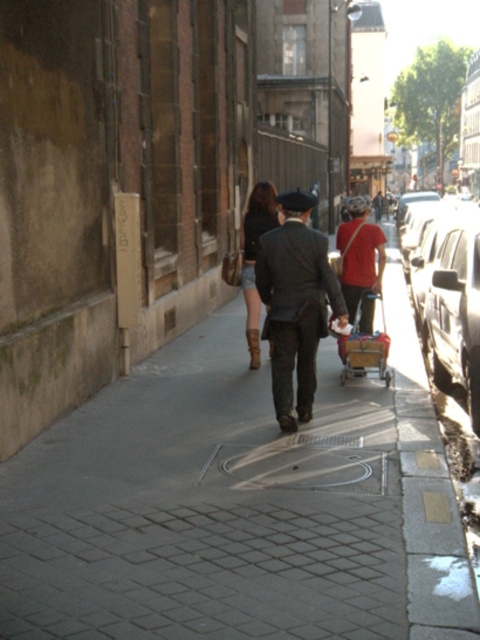
Question: Among these points, which one is nearest to the camera?

Choices:
 (A) (377, 266)
 (B) (474, 266)

Answer: (B)

Question: Estimate the real-world distances between objects in this image. Which object is farther from the shiny silver car at right?

Choices:
 (A) matte black coat at center
 (B) leather boots at center

Answer: (B)

Question: Observing the image, what is the correct spatial positioning of matte black coat at center in reference to shiny silver car at right?

Choices:
 (A) below
 (B) above

Answer: (A)

Question: Based on their relative distances, which object is farther from the matte red shirt at center?

Choices:
 (A) matte black coat at center
 (B) metallic silver shopping cart at center

Answer: (A)

Question: Can you confirm if matte black coat at center is bigger than leather boots at center?

Choices:
 (A) yes
 (B) no

Answer: (A)

Question: Does shiny silver car at right appear on the right side of leather boots at center?

Choices:
 (A) yes
 (B) no

Answer: (A)